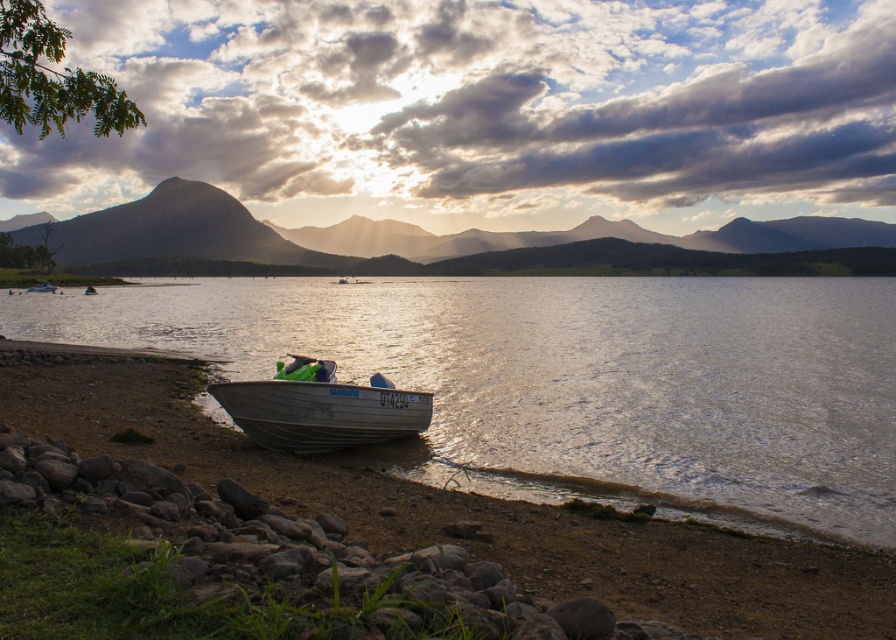
Measure the distance between clear water at boat left and camera.

clear water at boat left and camera are 9.77 meters apart from each other.

Can you confirm if clear water at boat left is wider than matte gray mountain at center?

No.

Locate an element on the screen. The height and width of the screenshot is (640, 896). clear water at boat left is located at coordinates (571, 380).

Is matte gray mountain at center positioned in front of silver metallic boat at lower center?

That is False.

Is matte gray mountain at center positioned at the back of silver metallic boat at lower center?

Yes, it is.

Where is `matte gray mountain at center`? This screenshot has height=640, width=896. matte gray mountain at center is located at coordinates (446, 244).

Who is higher up, clear water at boat left or silver metallic boat at lower center?

clear water at boat left

Does clear water at boat left appear on the left side of silver metallic boat at lower center?

Indeed, clear water at boat left is positioned on the left side of silver metallic boat at lower center.

This screenshot has height=640, width=896. In order to click on clear water at boat left in this screenshot , I will do `click(571, 380)`.